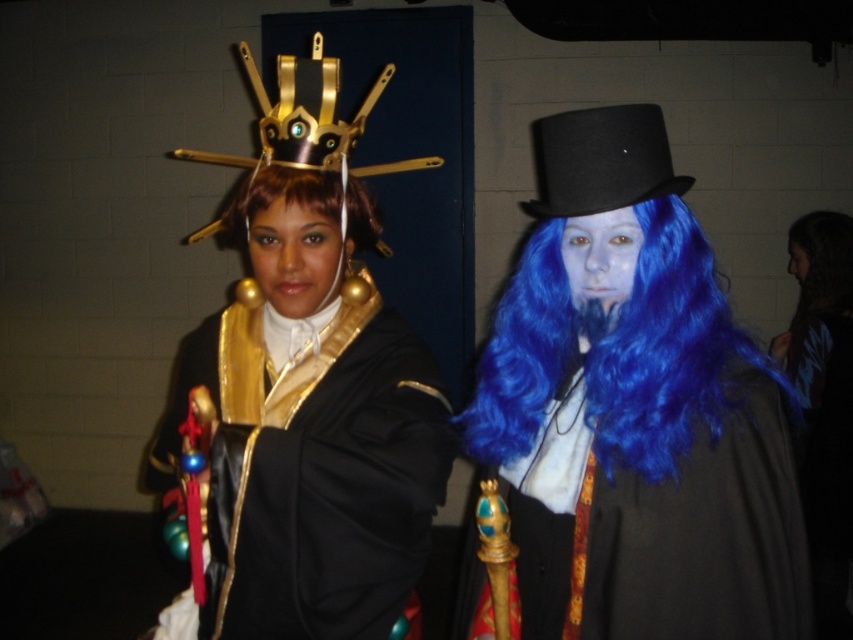
Does black satin robe at center lie behind blue matte wig at center?

No, it is not.

Is point (368, 506) in front of point (798, 260)?

Yes.

Locate an element on the screen. Image resolution: width=853 pixels, height=640 pixels. black satin robe at center is located at coordinates (312, 472).

Does point (351, 634) come behind point (846, 237)?

No, (351, 634) is closer to viewer.

Who is positioned more to the left, black satin robe at center or brown straight hair at upper right?

black satin robe at center

Find the location of a particular element. This screenshot has height=640, width=853. black satin robe at center is located at coordinates (312, 472).

Between matte gold crown at center and brown shiny hair at center, which one appears on the left side from the viewer's perspective?

Positioned to the left is brown shiny hair at center.

Does matte gold crown at center appear on the left side of brown shiny hair at center?

Incorrect, matte gold crown at center is not on the left side of brown shiny hair at center.

Where is `matte gold crown at center`? This screenshot has height=640, width=853. matte gold crown at center is located at coordinates (294, 257).